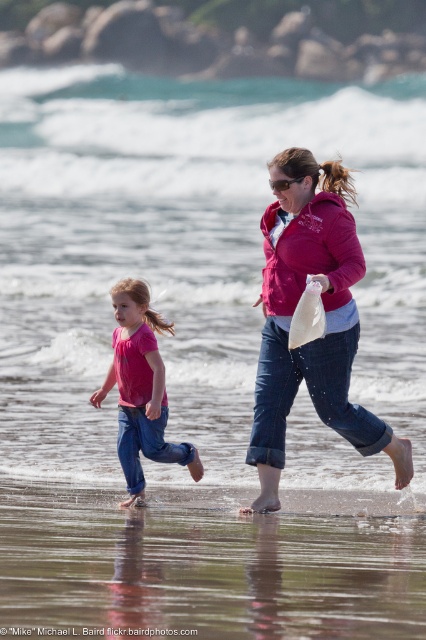
Question: Considering the real-world distances, which object is closest to the pink matte shirt at center?

Choices:
 (A) matte pink jacket at center
 (B) matte pink hoodie at center

Answer: (B)

Question: Which point is farther to the camera?

Choices:
 (A) matte pink jacket at center
 (B) matte pink hoodie at center
 (C) clear water at lower center

Answer: (C)

Question: Which object appears farthest from the camera in this image?

Choices:
 (A) matte pink jacket at center
 (B) clear water at lower center

Answer: (B)

Question: Is clear water at lower center behind matte pink hoodie at center?

Choices:
 (A) no
 (B) yes

Answer: (B)

Question: Is clear water at lower center wider than matte pink hoodie at center?

Choices:
 (A) yes
 (B) no

Answer: (A)

Question: Is matte pink hoodie at center above pink matte shirt at center?

Choices:
 (A) yes
 (B) no

Answer: (A)